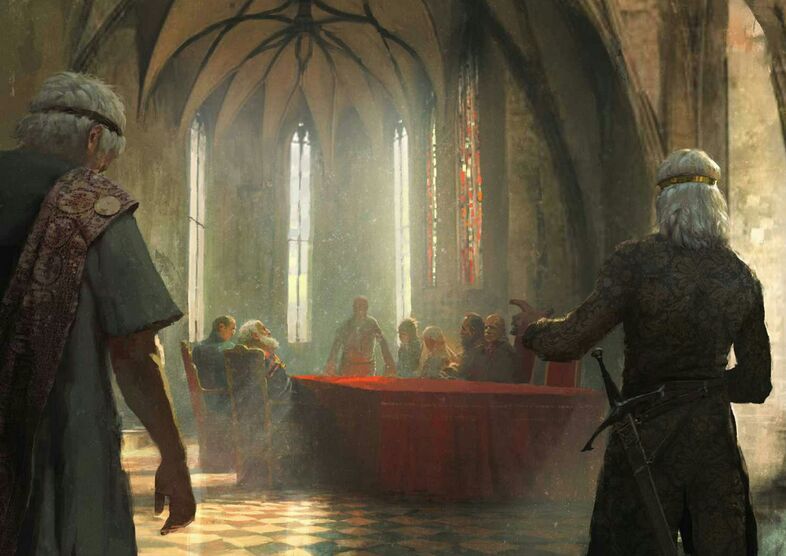
This screenshot has height=556, width=786. I want to click on floor, so click(x=296, y=534).